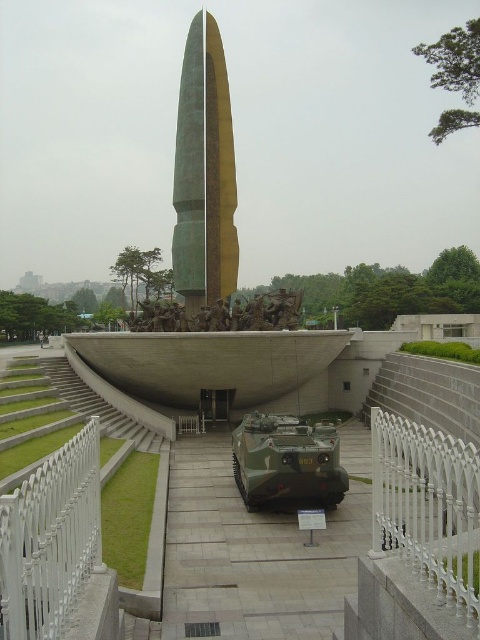
You are a visitor standing at the base of the monument. You want to take a photo of the green polished stone obelisk at center and the gray concrete stairs at center. Which object should you focus on first if you want to capture both in the frame without moving the camera?

The green polished stone obelisk at center is bigger than the gray concrete stairs at center, so you should focus on the green polished stone obelisk at center first to ensure it takes up enough space in the frame while still including the smaller gray concrete stairs at center.

You are standing at the base of the monument and want to take a photo of the monument. The camera you are using has a maximum focus range of 70 meters. Will the camera be able to focus on the point at point (x=132, y=317)?

The distance of point (x=132, y=317) from the camera is 73.49 meters, which exceeds the camera maximum focus range of 70 meters. Therefore, the camera will not be able to focus on that point.

You are a visitor standing at the base of the monument. You notice the green polished stone obelisk at center and the gray concrete stairs at center. Which object is taller?

The green polished stone obelisk at center is taller than the gray concrete stairs at center according to the description.